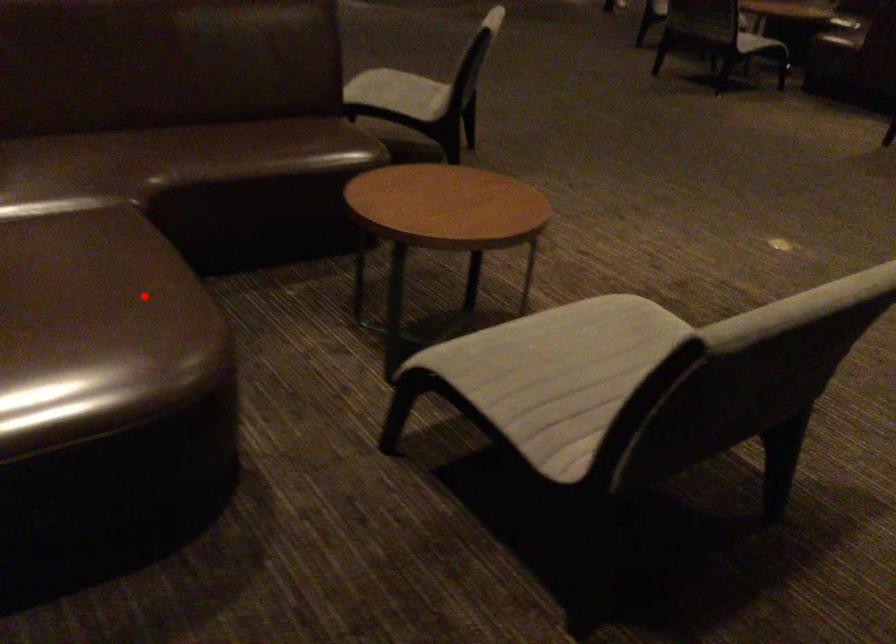
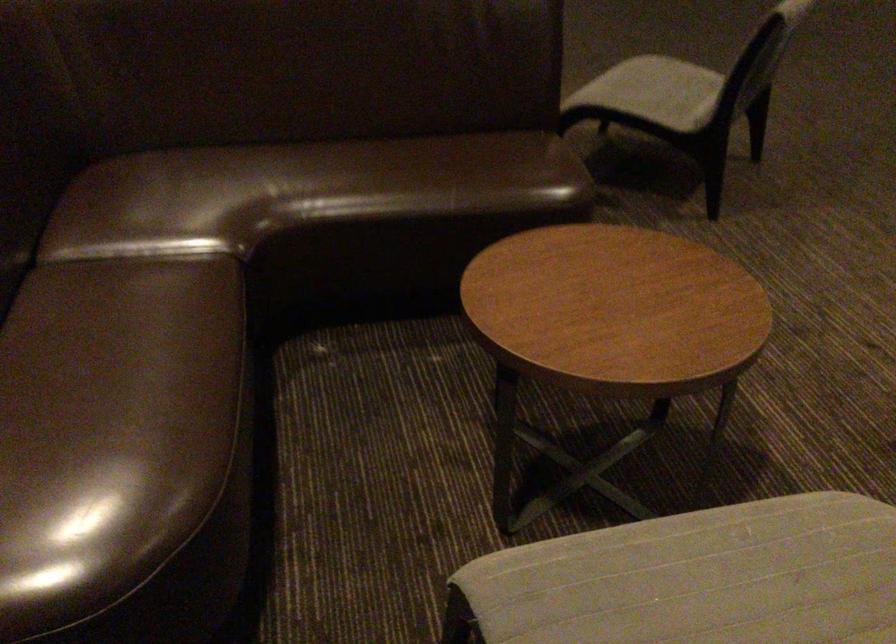
Question: I am providing you with two images of the same scene from different viewpoints. Image1 has a red point marked. In image2, the corresponding 3D location appears at what relative position? Reply with the corresponding letter.

Choices:
 (A) Closer
 (B) Farther

Answer: (A)